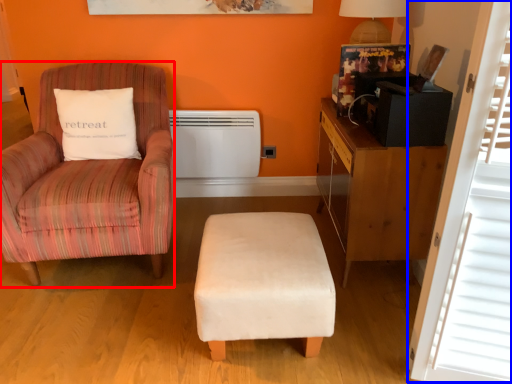
Question: Which point is closer to the camera, chair (highlighted by a red box) or window screen (highlighted by a blue box)?

Choices:
 (A) chair
 (B) window screen

Answer: (B)